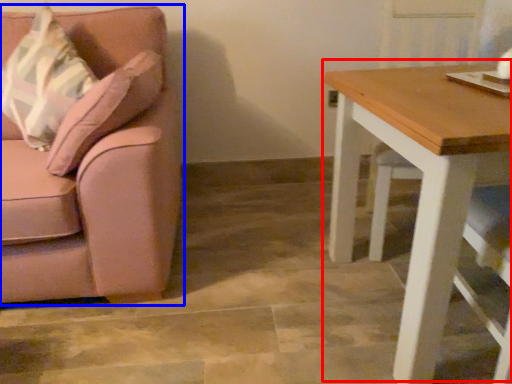
Question: Which object appears farthest to the camera in this image, table (highlighted by a red box) or chair (highlighted by a blue box)?

Choices:
 (A) table
 (B) chair

Answer: (B)